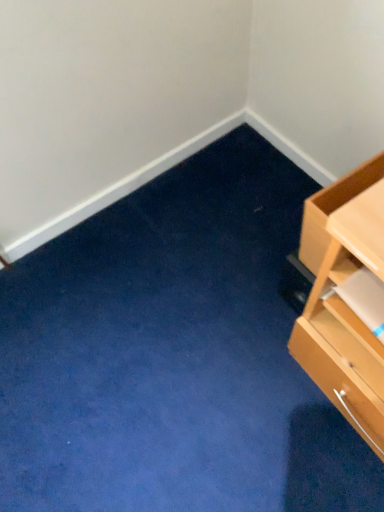
What do you see at coordinates (354, 325) in the screenshot?
I see `wooden shelf at right` at bounding box center [354, 325].

You are a GUI agent. You are given a task and a screenshot of the screen. Output one action in this format:
    pyautogui.click(x=<x>, y=<y>)
    Task: Click on the wooden shelf at right
    The height and width of the screenshot is (512, 384).
    Given the screenshot: What is the action you would take?
    pyautogui.click(x=354, y=325)

From the picture: Measure the distance between wooden shelf at right and camera.

wooden shelf at right is 78.50 centimeters from camera.

At what (x,y) coordinates should I click in order to perform the action: click on wooden shelf at right. Please return your answer as a coordinate pair (x, y). Looking at the image, I should click on (354, 325).